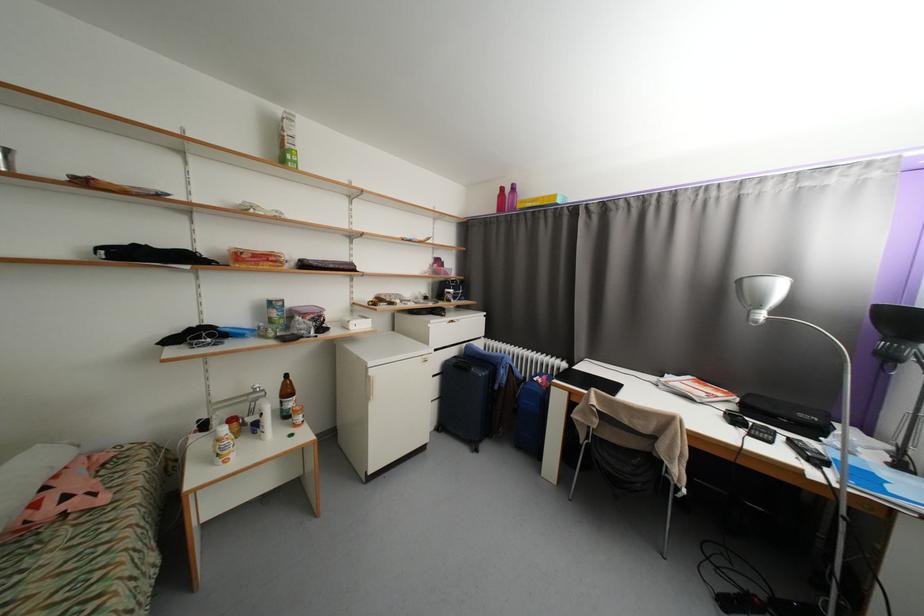
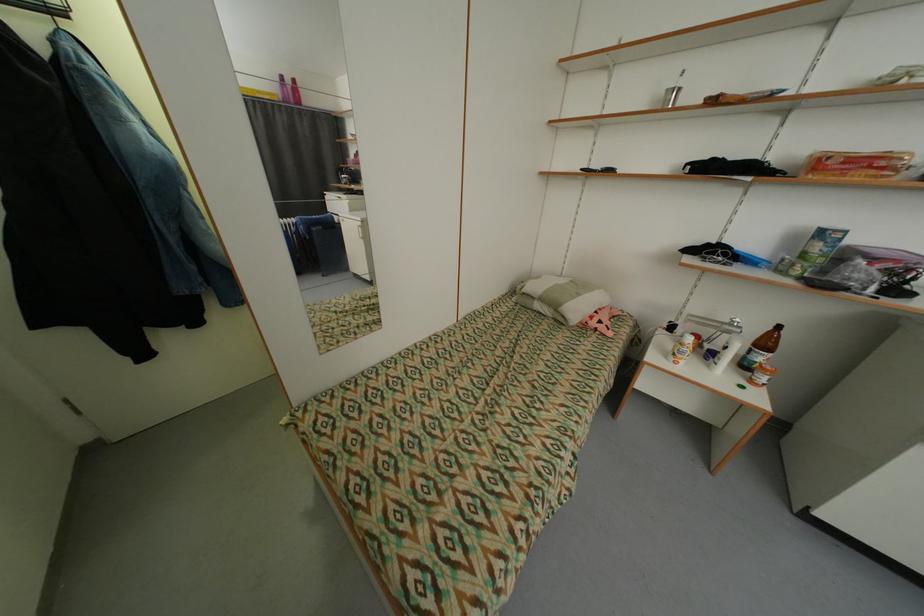
Where in the second image is the point corresponding to point (294, 392) from the first image?

(772, 345)